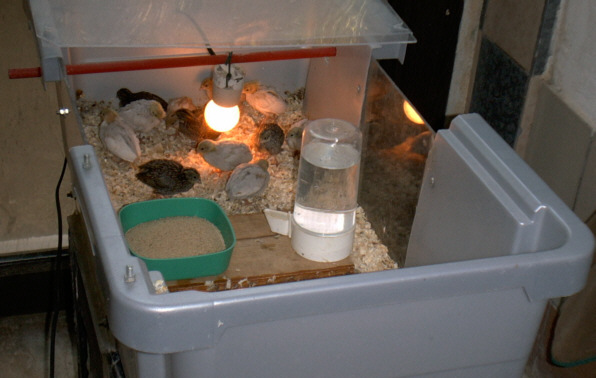
The width and height of the screenshot is (596, 378). I want to click on light bulb, so 218,113.